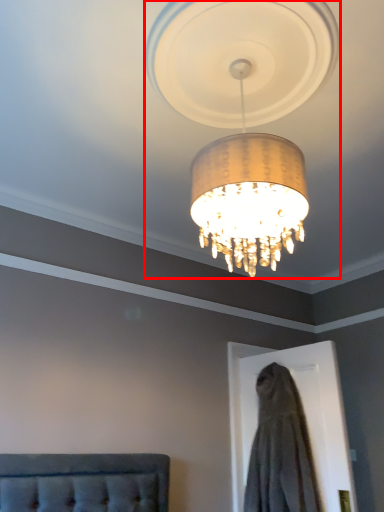
Question: From the image's perspective, what is the correct spatial positioning of lamp (annotated by the red box) in reference to dress?

Choices:
 (A) below
 (B) above

Answer: (B)